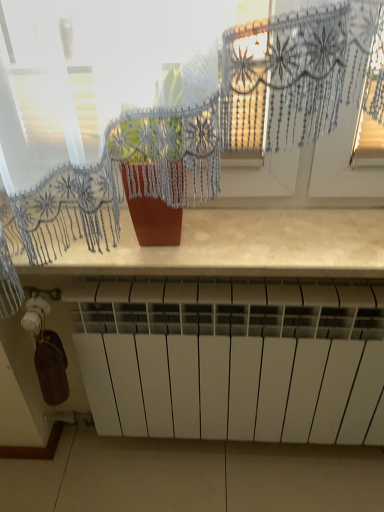
Question: Is white matte radiator at lower center oriented away from transparent lace curtain at upper center?

Choices:
 (A) no
 (B) yes

Answer: (A)

Question: From a real-world perspective, is white matte radiator at lower center located higher than transparent lace curtain at upper center?

Choices:
 (A) no
 (B) yes

Answer: (A)

Question: From the image's perspective, is white matte radiator at lower center below transparent lace curtain at upper center?

Choices:
 (A) yes
 (B) no

Answer: (A)

Question: Considering the relative sizes of white matte radiator at lower center and transparent lace curtain at upper center in the image provided, is white matte radiator at lower center smaller than transparent lace curtain at upper center?

Choices:
 (A) yes
 (B) no

Answer: (B)

Question: Are white matte radiator at lower center and transparent lace curtain at upper center beside each other?

Choices:
 (A) yes
 (B) no

Answer: (B)

Question: From a real-world perspective, is white matte radiator at lower center beneath transparent lace curtain at upper center?

Choices:
 (A) no
 (B) yes

Answer: (B)

Question: Is white matte radiator at lower center thinner than matte brown countertop at center?

Choices:
 (A) yes
 (B) no

Answer: (A)

Question: Is matte brown countertop at center located within white matte radiator at lower center?

Choices:
 (A) no
 (B) yes

Answer: (A)

Question: Is white matte radiator at lower center looking in the opposite direction of matte brown countertop at center?

Choices:
 (A) no
 (B) yes

Answer: (A)

Question: Is white matte radiator at lower center not near matte brown countertop at center?

Choices:
 (A) yes
 (B) no

Answer: (B)

Question: Considering the relative sizes of white matte radiator at lower center and matte brown countertop at center in the image provided, is white matte radiator at lower center shorter than matte brown countertop at center?

Choices:
 (A) no
 (B) yes

Answer: (A)

Question: Is white matte radiator at lower center outside of matte brown countertop at center?

Choices:
 (A) no
 (B) yes

Answer: (B)

Question: Would you say transparent lace curtain at upper center is outside matte brown countertop at center?

Choices:
 (A) no
 (B) yes

Answer: (B)